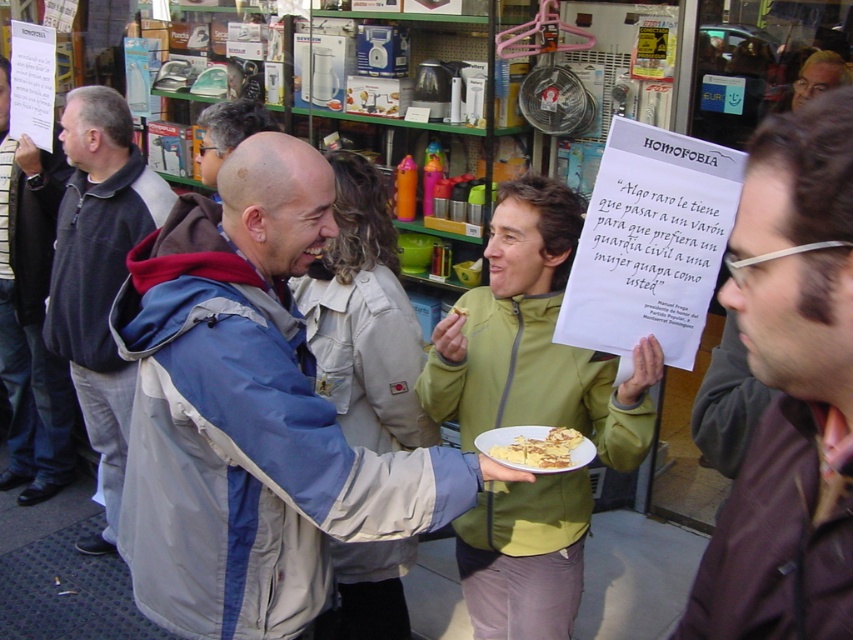
You are a delivery person who just arrived at the shop. You see the brown leather jacket at center. Can you hand a package to them without moving closer than 30 inches?

The distance between you and the brown leather jacket at center is 29.42 inches, which is less than 30 inches. Therefore, you cannot hand the package without moving closer than the specified distance.

You are a photographer trying to capture a candid shot of the two people in the scene. To avoid blocking the view, you need to position yourself so that the blue fabric jacket at center and the smooth brown hair at upper right are both visible. Based on their positions, which side should you stand to ensure both are in frame without obstruction?

You should stand to the right side of the scene because the blue fabric jacket at center is to the left of the smooth brown hair at upper right, so positioning yourself on the right will allow both to be visible without obstruction.